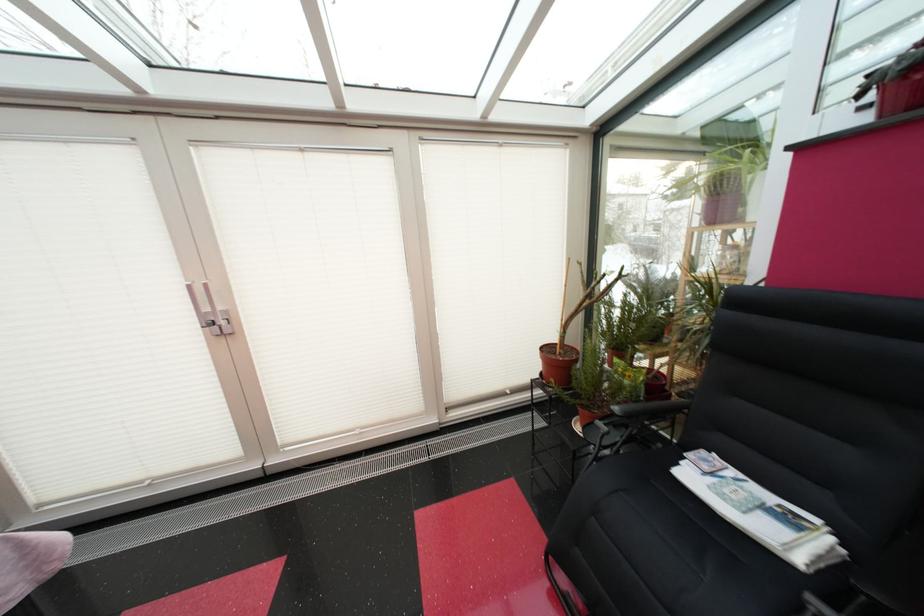
The image size is (924, 616). Find the location of `black chair sitting surface`. black chair sitting surface is located at coordinates (745, 501).